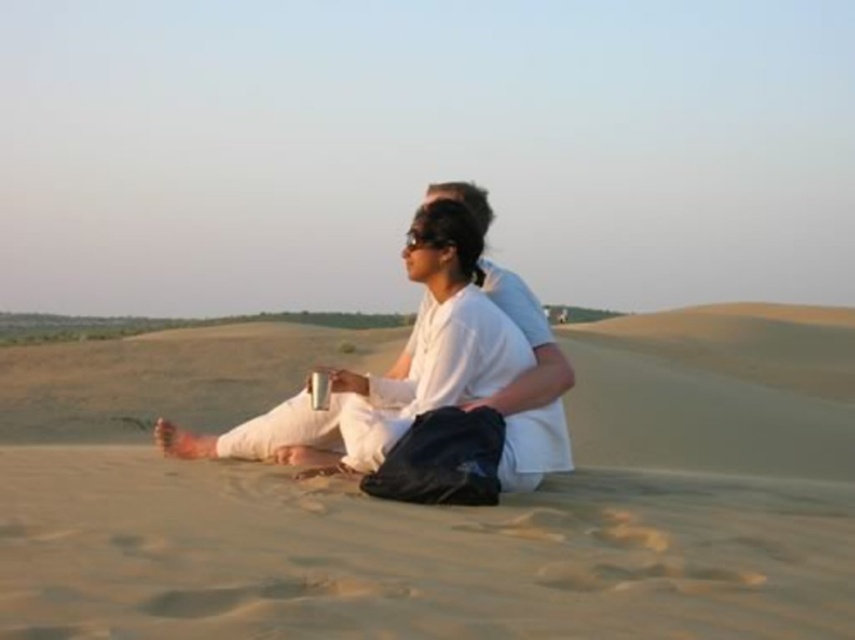
You are a photographer trying to capture a clear shot of both the white matte clothing at center and the black matte goggles at center. Since the camera can only focus on one object at a time, which object should you focus on to ensure the other remains in the background?

The white matte clothing at center is below the black matte goggles at center, so focusing on the white matte clothing at center will keep the black matte goggles at center in the background.

You are a photographer trying to capture a clear shot of both the white matte clothing at center and the black matte goggles at center. Since they are positioned at the same location, which one will appear larger in the photo?

The white matte clothing at center will appear larger in the photo because it is much taller than the black matte goggles at center.

Consider the image. You are a photographer trying to capture a clear shot of both the white matte clothing at center and the black matte goggles at center. Since you can only focus on one object at a time, which object should you focus on to ensure the other is still in the background?

You should focus on the white matte clothing at center because it is closer to the viewer, and the black matte goggles at center will naturally be in the background.